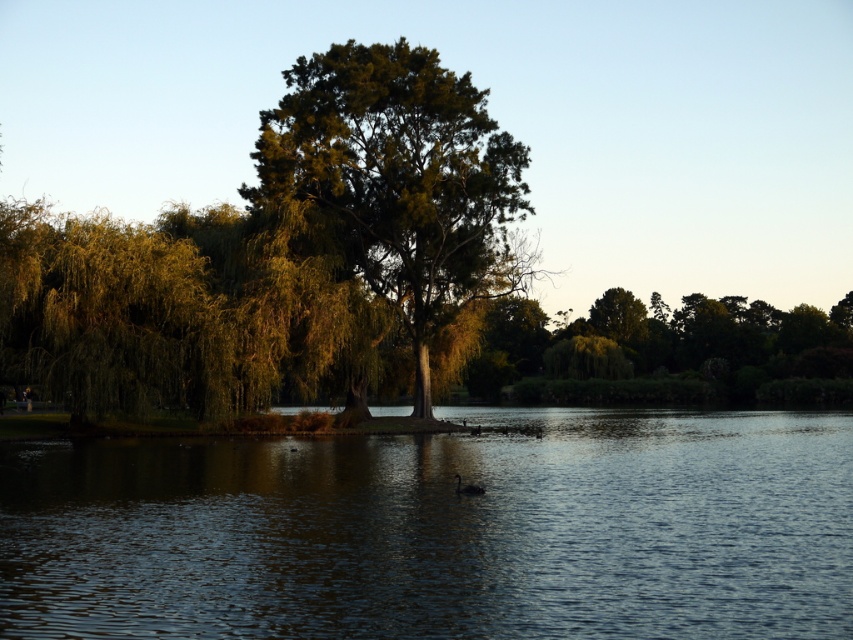
You are standing at the lakeside and want to observe both the dark reflective water at center and the black matte duck at center. Which object is positioned to the left when viewed from your perspective?

The dark reflective water at center is to the left of the black matte duck at center, so when viewed from your perspective at the lakeside, the dark reflective water at center is positioned to the left.

You are standing at the lakeside and notice the dark reflective water at center and the green leafy tree at center. Which object is positioned lower in the image?

The dark reflective water at center is located below the green leafy tree at center, so it is positioned lower in the image.